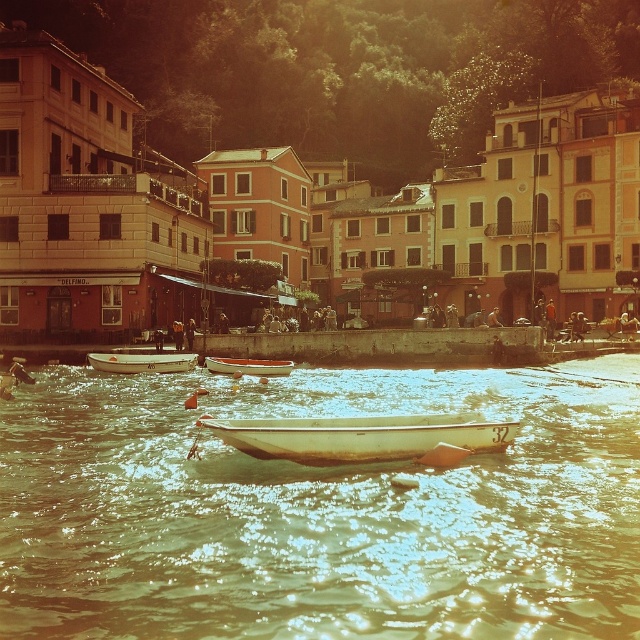
Question: Which object is positioned farthest from the wooden boat at center?

Choices:
 (A) white matte boat at lower left
 (B) white matte boat at center
 (C) clear water at boat center

Answer: (B)

Question: Can you confirm if clear water at boat center is positioned to the right of wooden boat at center?

Choices:
 (A) yes
 (B) no

Answer: (A)

Question: Does clear water at boat center have a lesser width compared to white matte boat at lower left?

Choices:
 (A) no
 (B) yes

Answer: (A)

Question: Estimate the real-world distances between objects in this image. Which object is closer to the white matte boat at lower left?

Choices:
 (A) white matte boat at center
 (B) clear water at boat center
 (C) wooden boat at center

Answer: (C)

Question: Can you confirm if white matte boat at center is wider than wooden boat at center?

Choices:
 (A) no
 (B) yes

Answer: (B)

Question: Which point is farther to the camera?

Choices:
 (A) clear water at boat center
 (B) wooden boat at center

Answer: (B)